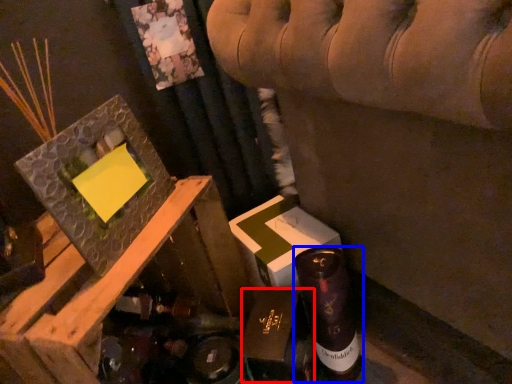
Question: Which object is further to the camera taking this photo, cardboard box (highlighted by a red box) or bottle (highlighted by a blue box)?

Choices:
 (A) cardboard box
 (B) bottle

Answer: (B)